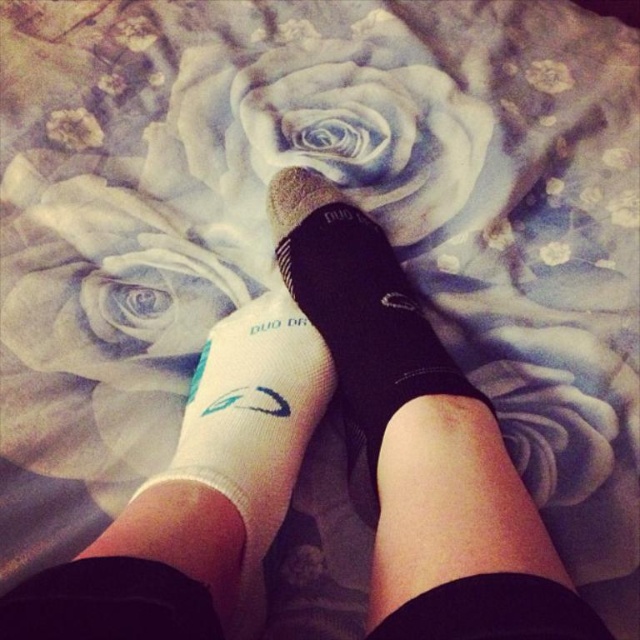
Question: Does black textured socks at center have a smaller size compared to white fabric sock at lower center?

Choices:
 (A) yes
 (B) no

Answer: (B)

Question: Which is farther from the white fabric sock at lower center?

Choices:
 (A) white fabric rose at upper center
 (B) black textured socks at center

Answer: (A)

Question: Does black textured socks at center appear on the left side of white fabric rose at upper center?

Choices:
 (A) no
 (B) yes

Answer: (A)

Question: Does white fabric rose at upper center appear under white fabric sock at lower center?

Choices:
 (A) yes
 (B) no

Answer: (B)

Question: Based on their relative distances, which object is nearer to the white fabric rose at upper center?

Choices:
 (A) white fabric sock at lower center
 (B) black textured socks at center

Answer: (B)

Question: Among these points, which one is nearest to the camera?

Choices:
 (A) (292, 358)
 (B) (376, 74)
 (C) (282, 241)

Answer: (A)